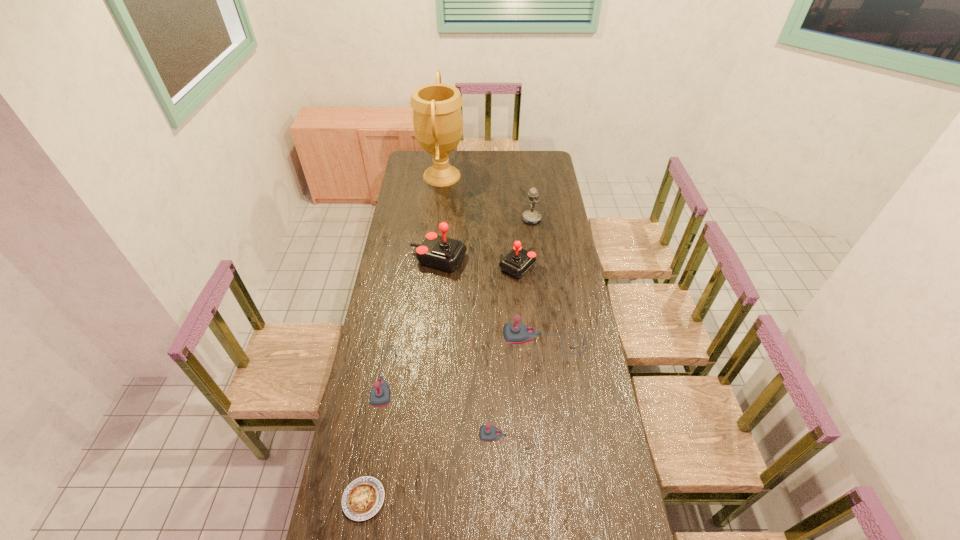
Where is `free space located 0.140m on the right of the second tallest joystick`? The image size is (960, 540). free space located 0.140m on the right of the second tallest joystick is located at coordinates (565, 266).

Where is `blank space located on the left of the fifth shortest object`? blank space located on the left of the fifth shortest object is located at coordinates (441, 340).

You are a GUI agent. You are given a task and a screenshot of the screen. Output one action in this format:
    pyautogui.click(x=<x>, y=<y>)
    Task: Click on the free space located 0.180m on the front of the fourth tallest joystick
    This screenshot has width=960, height=540.
    Given the screenshot: What is the action you would take?
    pyautogui.click(x=373, y=457)

Where is `free space located 0.380m on the back of the smallest gray joystick`? This screenshot has width=960, height=540. free space located 0.380m on the back of the smallest gray joystick is located at coordinates (504, 340).

Image resolution: width=960 pixels, height=540 pixels. I want to click on vacant space situated 0.120m on the back of the second shortest object, so click(373, 442).

Locate an element on the screen. object positioned at the far edge is located at coordinates (437, 117).

The height and width of the screenshot is (540, 960). Find the location of `trophy positioned at the left edge`. trophy positioned at the left edge is located at coordinates (437, 117).

Identify the location of quiche situated at the left edge. The height and width of the screenshot is (540, 960). (362, 499).

Locate an element on the screen. Image resolution: width=960 pixels, height=540 pixels. microphone located in the right edge section of the desktop is located at coordinates (531, 217).

Identify the location of joystick at the right edge. point(514,333).